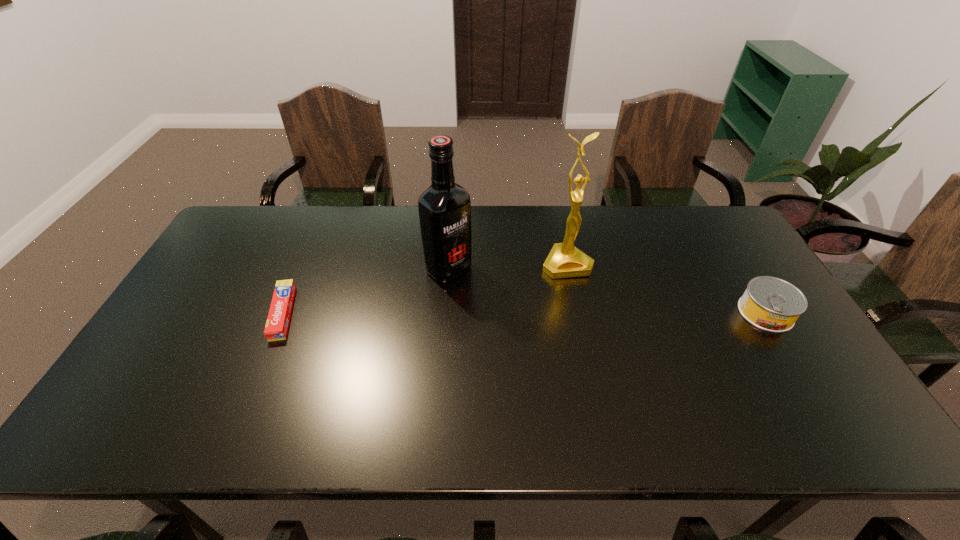
At what (x,y) coordinates should I click in order to perform the action: click on vacant area that lies between the can and the liquor. Please return your answer as a coordinate pair (x, y). Looking at the image, I should click on (607, 291).

The image size is (960, 540). Find the location of `vacant space that's between the leftmost object and the second shortest object`. vacant space that's between the leftmost object and the second shortest object is located at coordinates (524, 313).

Where is `vacant region between the award and the third object from right to left`? Image resolution: width=960 pixels, height=540 pixels. vacant region between the award and the third object from right to left is located at coordinates 508,266.

This screenshot has height=540, width=960. Find the location of `free point between the toothpaste and the second shortest object`. free point between the toothpaste and the second shortest object is located at coordinates (524, 313).

Where is `blank region between the toothpaste and the award`? This screenshot has width=960, height=540. blank region between the toothpaste and the award is located at coordinates (424, 288).

Locate an element on the screen. free space between the can and the award is located at coordinates (666, 288).

The height and width of the screenshot is (540, 960). Identify the location of vacant area between the second object from right to left and the liquor. (508, 266).

The width and height of the screenshot is (960, 540). What are the coordinates of `vacant space that's between the toothpaste and the third object from right to left` in the screenshot? It's located at (366, 291).

I want to click on free spot between the leftmost object and the liquor, so click(366, 291).

Where is `vacant area between the second object from right to left and the second object from left to right`? vacant area between the second object from right to left and the second object from left to right is located at coordinates (508, 266).